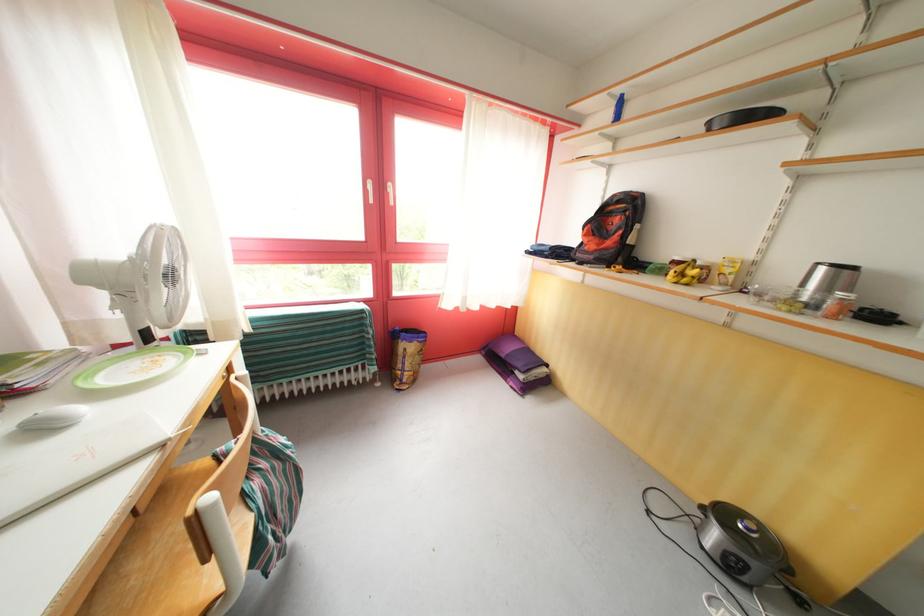
Find where to pull the white chair handle. Please return your answer as a coordinate pair (x, y).

(223, 548)